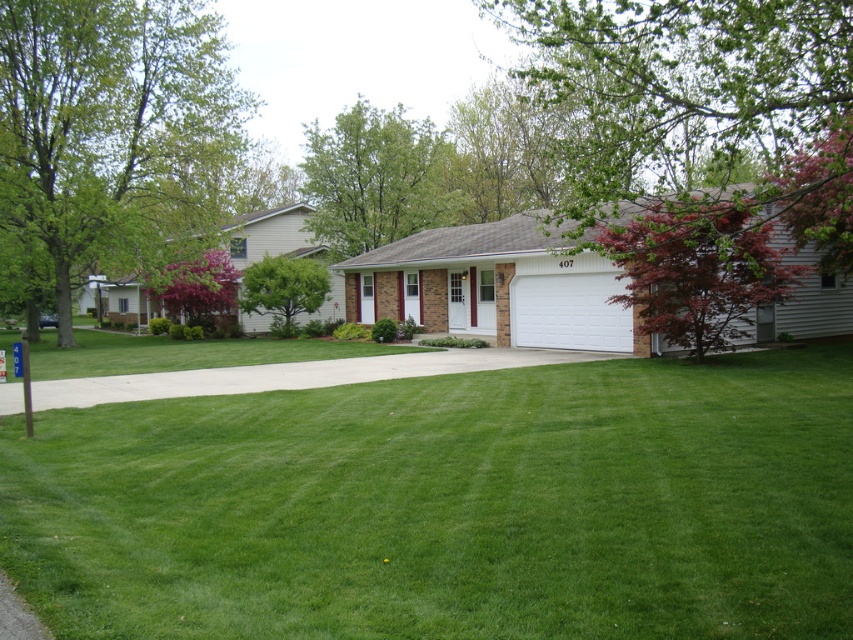
Between green grass at center and red leafy tree at right, which one appears on the right side from the viewer's perspective?

Positioned to the right is red leafy tree at right.

Is green grass at center taller than red leafy tree at right?

Incorrect, green grass at center's height is not larger of red leafy tree at right's.

Is point (442, 502) farther from camera compared to point (746, 241)?

No.

The image size is (853, 640). In order to click on green grass at center in this screenshot , I will do `click(450, 506)`.

Is reddish-brown bark tree at right smaller than green leafy tree at upper left?

Actually, reddish-brown bark tree at right might be larger than green leafy tree at upper left.

What do you see at coordinates (704, 96) in the screenshot?
I see `reddish-brown bark tree at right` at bounding box center [704, 96].

You are a GUI agent. You are given a task and a screenshot of the screen. Output one action in this format:
    pyautogui.click(x=<x>, y=<y>)
    Task: Click on the reddish-brown bark tree at right
    Image resolution: width=853 pixels, height=640 pixels.
    Given the screenshot: What is the action you would take?
    pyautogui.click(x=704, y=96)

What do you see at coordinates (697, 268) in the screenshot? I see `red leafy tree at right` at bounding box center [697, 268].

Who is more forward, (x=619, y=248) or (x=265, y=298)?

Point (x=619, y=248)

Between point (718, 333) and point (281, 291), which one is positioned in front?

Point (718, 333) is in front.

This screenshot has height=640, width=853. I want to click on red leafy tree at right, so pos(697,268).